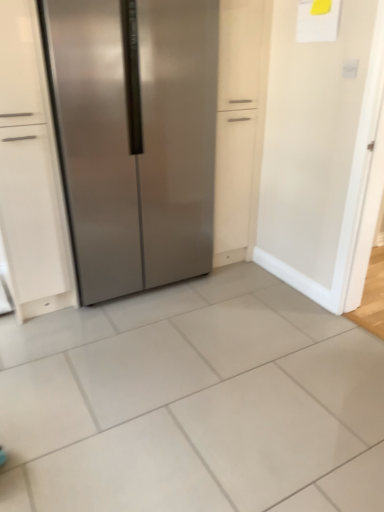
The width and height of the screenshot is (384, 512). What are the coordinates of `stainless steel refrigerator at center` in the screenshot? It's located at (136, 138).

What do you see at coordinates (136, 138) in the screenshot? This screenshot has height=512, width=384. I see `stainless steel refrigerator at center` at bounding box center [136, 138].

This screenshot has height=512, width=384. I want to click on stainless steel refrigerator at center, so click(x=136, y=138).